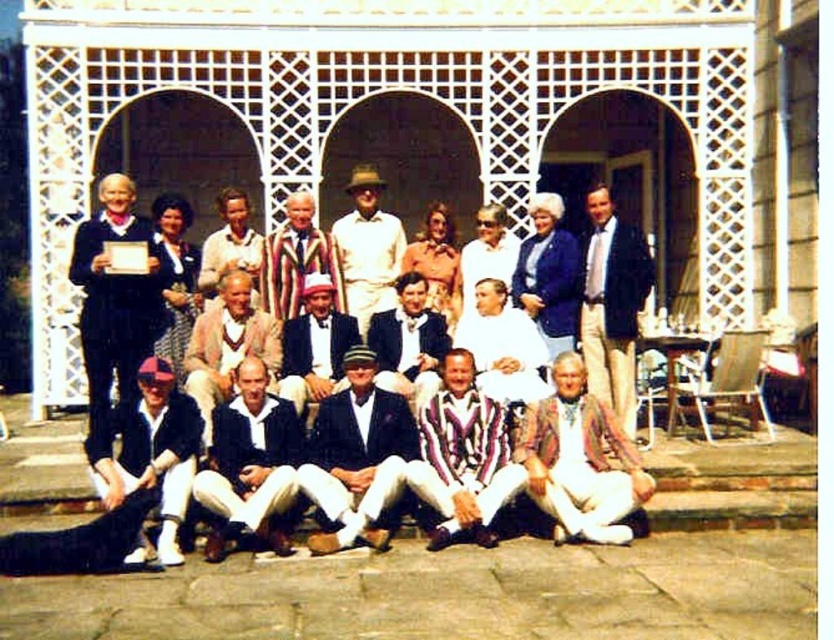
From the picture: Which is more to the right, light brown cotton pants at center or striped fabric suit at center?

light brown cotton pants at center

Is point (623, 259) positioned behind point (402, 346)?

Yes, it is.

This screenshot has height=640, width=834. I want to click on light brown cotton pants at center, so click(x=611, y=307).

Does point (198, 365) lie in front of point (520, 256)?

Yes, point (198, 365) is closer to viewer.

What do you see at coordinates (229, 346) in the screenshot?
I see `light pink fabric suit at center` at bounding box center [229, 346].

Locate an element on the screen. The width and height of the screenshot is (834, 640). light pink fabric suit at center is located at coordinates (229, 346).

Looking at this image, can you confirm if blue woolen sweater at center is bigger than striped fabric shirt at center?

Incorrect, blue woolen sweater at center is not larger than striped fabric shirt at center.

Between blue woolen sweater at center and striped fabric shirt at center, which one appears on the left side from the viewer's perspective?

From the viewer's perspective, striped fabric shirt at center appears more on the left side.

Is point (556, 352) positioned in front of point (224, 208)?

Yes, point (556, 352) is closer to viewer.

Find the location of a particular element. The image size is (834, 640). blue woolen sweater at center is located at coordinates (548, 275).